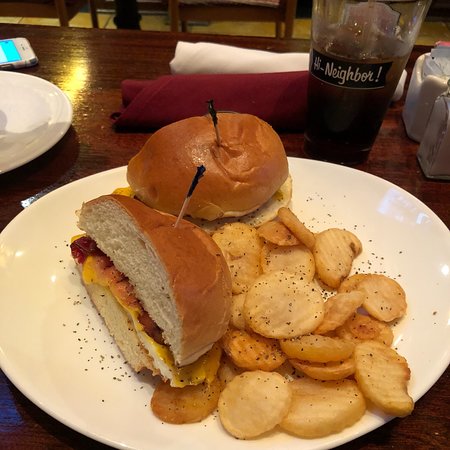
Identify the location of back of seat. Image resolution: width=450 pixels, height=450 pixels. (239, 13), (24, 12).